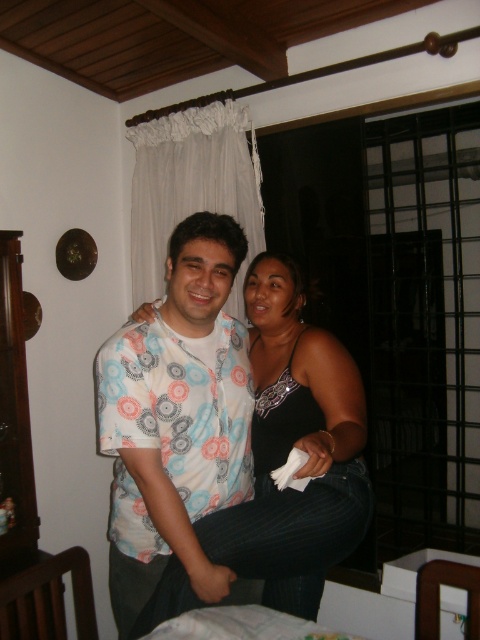
Question: Which point is closer to the camera taking this photo?

Choices:
 (A) (312, 611)
 (B) (231, 332)

Answer: (B)

Question: From the image, what is the correct spatial relationship of white printed shirt at center in relation to black satin tank top at center?

Choices:
 (A) below
 (B) above

Answer: (A)

Question: Can you confirm if white printed shirt at center is wider than black satin tank top at center?

Choices:
 (A) yes
 (B) no

Answer: (A)

Question: Is white printed shirt at center smaller than black satin tank top at center?

Choices:
 (A) yes
 (B) no

Answer: (A)

Question: Which of the following is the farthest from the observer?

Choices:
 (A) (336, 355)
 (B) (111, 388)

Answer: (A)